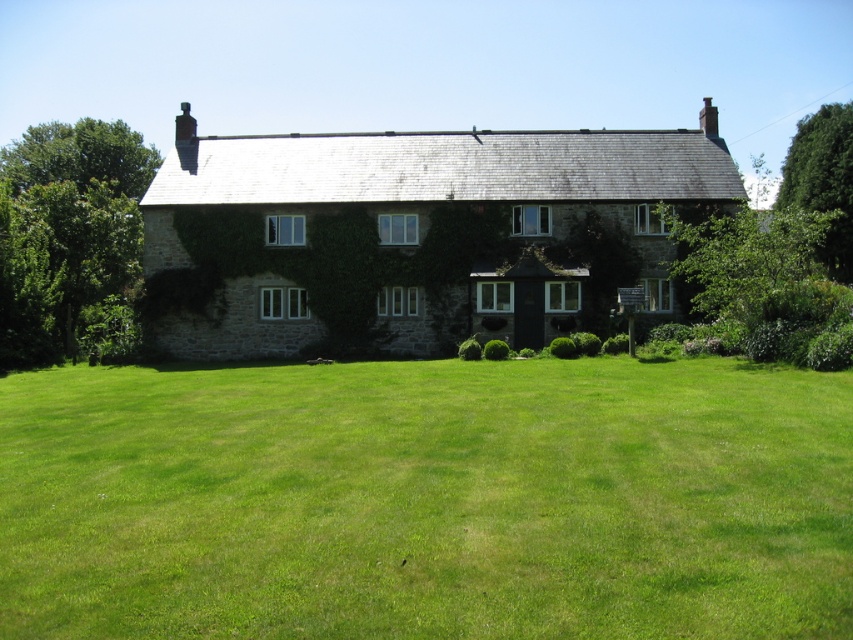
Question: Does green grass at center lie behind stone cottage at center?

Choices:
 (A) yes
 (B) no

Answer: (B)

Question: Which object appears closest to the camera in this image?

Choices:
 (A) stone cottage at center
 (B) green grass at center

Answer: (B)

Question: Can you confirm if green grass at center is positioned above stone cottage at center?

Choices:
 (A) yes
 (B) no

Answer: (B)

Question: Does green grass at center appear on the right side of stone cottage at center?

Choices:
 (A) no
 (B) yes

Answer: (A)

Question: Which of the following is the farthest from the observer?

Choices:
 (A) green grass at center
 (B) stone cottage at center

Answer: (B)